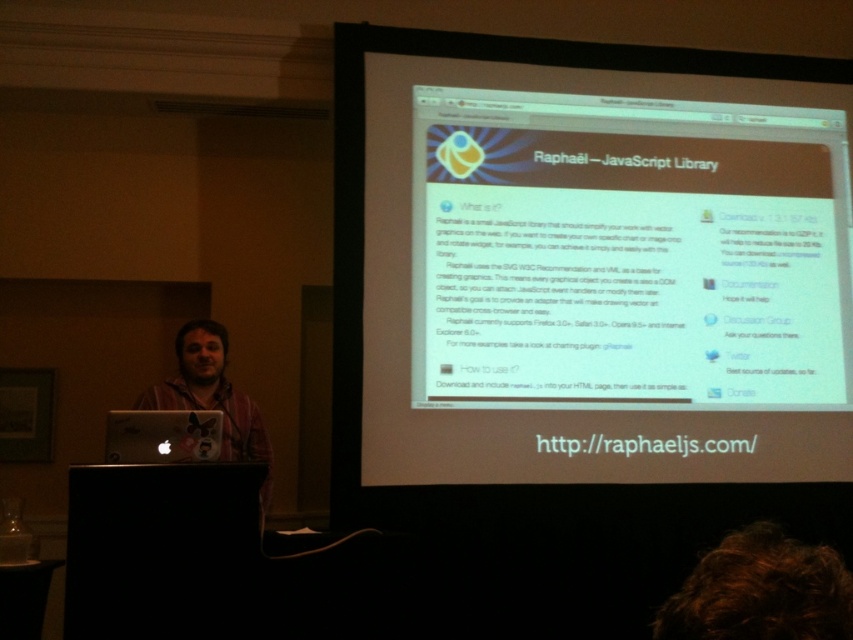
You are organizing a tech conference and need to ensure that the projection screen is visible to all attendees. Given that the white glossy computer screen at center and the matte black laptop at left are both in the presentation area, which one is more suitable for displaying the main presentation content?

The white glossy computer screen at center is larger in size than the matte black laptop at left, making it more suitable for displaying the main presentation content as it can be seen by all attendees.

You are organizing a tech conference and need to set up two laptops for a presentation. The matte black laptop at left and the matte gold laptop at center are available. According to the image, which laptop has a larger width?

The matte black laptop at left might be wider than the matte gold laptop at center, so it is possible that the matte black laptop at left has a larger width.